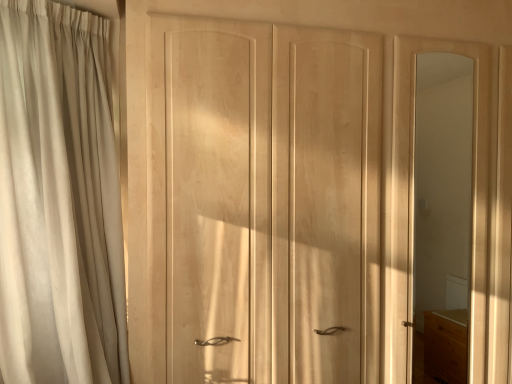
Image resolution: width=512 pixels, height=384 pixels. What do you see at coordinates (278, 199) in the screenshot? I see `natural wood wardrobe at center` at bounding box center [278, 199].

Locate an element on the screen. matte wood mirror at right is located at coordinates (413, 198).

Is natural wood wardrobe at center wider than beige fabric curtain at left?

In fact, natural wood wardrobe at center might be narrower than beige fabric curtain at left.

Considering the sizes of objects natural wood wardrobe at center and beige fabric curtain at left in the image provided, who is smaller, natural wood wardrobe at center or beige fabric curtain at left?

natural wood wardrobe at center is smaller.

From the picture: Is natural wood wardrobe at center next to beige fabric curtain at left and touching it?

No.

Looking at this image, from a real-world perspective, is natural wood wardrobe at center positioned over beige fabric curtain at left based on gravity?

No, from a real-world perspective, natural wood wardrobe at center is not on top of beige fabric curtain at left.

Considering the relative sizes of beige fabric curtain at left and matte wood mirror at right in the image provided, is beige fabric curtain at left wider than matte wood mirror at right?

Yes, beige fabric curtain at left is wider than matte wood mirror at right.

Considering the relative sizes of beige fabric curtain at left and matte wood mirror at right in the image provided, is beige fabric curtain at left bigger than matte wood mirror at right?

Yes.

From the image's perspective, is beige fabric curtain at left located above matte wood mirror at right?

Yes, from the image's perspective, beige fabric curtain at left is over matte wood mirror at right.

Considering the sizes of objects beige fabric curtain at left and matte wood mirror at right in the image provided, who is shorter, beige fabric curtain at left or matte wood mirror at right?

beige fabric curtain at left.

Is point (484, 371) positioned in front of point (97, 171)?

No.

Which is behind, matte wood mirror at right or beige fabric curtain at left?

matte wood mirror at right is behind.

Is matte wood mirror at right inside the boundaries of beige fabric curtain at left, or outside?

matte wood mirror at right is not inside beige fabric curtain at left, it's outside.

Would you consider matte wood mirror at right to be distant from beige fabric curtain at left?

Yes, matte wood mirror at right and beige fabric curtain at left are located far from each other.

Can you confirm if beige fabric curtain at left is smaller than natural wood wardrobe at center?

No, beige fabric curtain at left is not smaller than natural wood wardrobe at center.

In the image, is beige fabric curtain at left positioned in front of or behind natural wood wardrobe at center?

Visually, beige fabric curtain at left is located in front of natural wood wardrobe at center.

Choose the correct answer: Is beige fabric curtain at left inside natural wood wardrobe at center or outside it?

The correct answer is: outside.

Considering the sizes of objects natural wood wardrobe at center and matte wood mirror at right in the image provided, who is taller, natural wood wardrobe at center or matte wood mirror at right?

With more height is matte wood mirror at right.

Between natural wood wardrobe at center and matte wood mirror at right, which one appears on the left side from the viewer's perspective?

natural wood wardrobe at center.

Considering the relative sizes of natural wood wardrobe at center and matte wood mirror at right in the image provided, is natural wood wardrobe at center wider than matte wood mirror at right?

Yes, natural wood wardrobe at center is wider than matte wood mirror at right.

How different are the orientations of matte wood mirror at right and natural wood wardrobe at center in degrees?

The angle between the facing direction of matte wood mirror at right and the facing direction of natural wood wardrobe at center is 0.429 degrees.

The width and height of the screenshot is (512, 384). I want to click on door that is above the matte wood mirror at right (from the image's perspective), so click(278, 199).

Between matte wood mirror at right and natural wood wardrobe at center, which one has larger width?

Wider between the two is natural wood wardrobe at center.

Visually, is matte wood mirror at right positioned to the left or to the right of natural wood wardrobe at center?

From the image, it's evident that matte wood mirror at right is to the right of natural wood wardrobe at center.

Where is `door located underneath the beige fabric curtain at left (from a real-world perspective)`? The image size is (512, 384). door located underneath the beige fabric curtain at left (from a real-world perspective) is located at coordinates (278, 199).

Identify the location of screen door that is behind the beige fabric curtain at left. The image size is (512, 384). (413, 198).

Which object lies nearer to the anchor point matte wood mirror at right, natural wood wardrobe at center or beige fabric curtain at left?

Among the two, natural wood wardrobe at center is located nearer to matte wood mirror at right.

Considering their positions, is matte wood mirror at right positioned closer to natural wood wardrobe at center than beige fabric curtain at left?

The object closer to natural wood wardrobe at center is matte wood mirror at right.

Estimate the real-world distances between objects in this image. Which object is further from beige fabric curtain at left, natural wood wardrobe at center or matte wood mirror at right?

matte wood mirror at right.

Estimate the real-world distances between objects in this image. Which object is further from matte wood mirror at right, beige fabric curtain at left or natural wood wardrobe at center?

beige fabric curtain at left lies further to matte wood mirror at right than the other object.

Which object lies nearer to the anchor point natural wood wardrobe at center, beige fabric curtain at left or matte wood mirror at right?

matte wood mirror at right lies closer to natural wood wardrobe at center than the other object.

Estimate the real-world distances between objects in this image. Which object is closer to beige fabric curtain at left, matte wood mirror at right or natural wood wardrobe at center?

natural wood wardrobe at center is positioned closer to the anchor beige fabric curtain at left.

The height and width of the screenshot is (384, 512). Find the location of `door located between beige fabric curtain at left and matte wood mirror at right in the left-right direction`. door located between beige fabric curtain at left and matte wood mirror at right in the left-right direction is located at coordinates (278, 199).